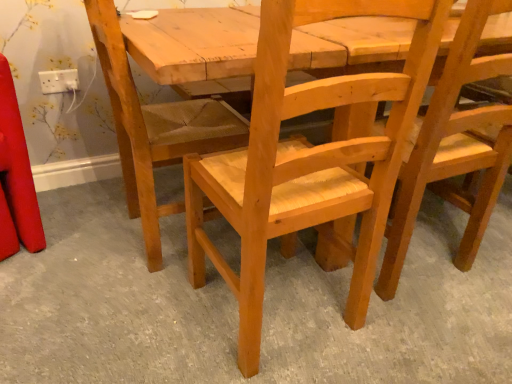
Question: Visually, is white plastic socket at upper left positioned to the left or to the right of natural wood chair at center?

Choices:
 (A) left
 (B) right

Answer: (A)

Question: Looking at the image, does white plastic socket at upper left seem bigger or smaller compared to natural wood chair at center?

Choices:
 (A) small
 (B) big

Answer: (A)

Question: Estimate the real-world distances between objects in this image. Which object is closer to the natural wood chair at center?

Choices:
 (A) white plastic socket at upper left
 (B) natural wood chair at center, the second chair when ordered from left to right
 (C) natural wood chair at center, marked as the 1th chair in a left-to-right arrangement
 (D) natural wood chair at center, which ranks as the third chair in left-to-right order

Answer: (B)

Question: Which object is the closest to the white plastic socket at upper left?

Choices:
 (A) natural wood chair at center, marked as the 1th chair in a left-to-right arrangement
 (B) natural wood chair at center, which ranks as the third chair in left-to-right order
 (C) natural wood chair at center
 (D) natural wood chair at center, which is the second chair in right-to-left order

Answer: (A)